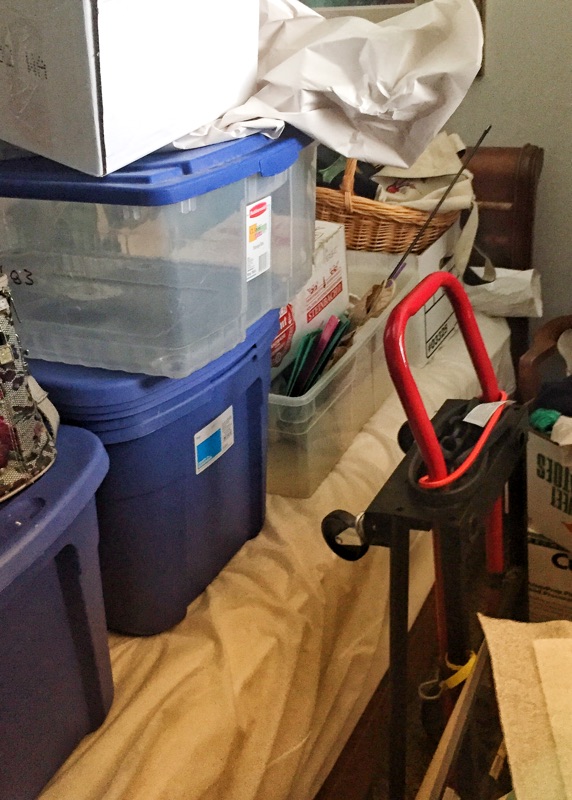
Where is `brown wooden headboard`? brown wooden headboard is located at coordinates (480, 173).